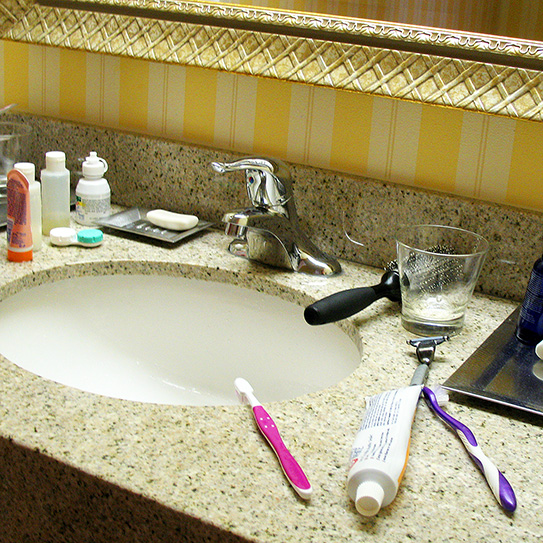
You are a GUI agent. You are given a task and a screenshot of the screen. Output one action in this format:
    pyautogui.click(x=<x>, y=<y>)
    Task: Click on the granite surface
    Image resolution: width=543 pixels, height=543 pixels.
    Given the screenshot: What is the action you would take?
    pyautogui.click(x=201, y=475)